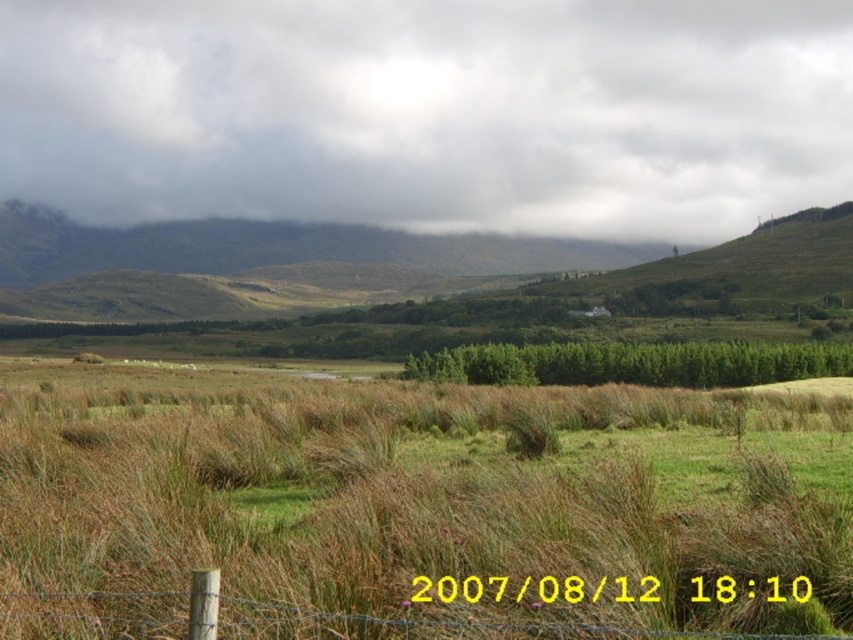
Question: Based on their relative distances, which object is farther from the brown dry grass at center?

Choices:
 (A) brown wooden fence at lower center
 (B) cloudy gray sky at upper center

Answer: (B)

Question: Considering the relative positions of cloudy gray sky at upper center and brown wooden fence at lower center in the image provided, where is cloudy gray sky at upper center located with respect to brown wooden fence at lower center?

Choices:
 (A) right
 (B) left

Answer: (B)

Question: Where is brown dry grass at center located in relation to brown wooden fence at lower center in the image?

Choices:
 (A) below
 (B) above

Answer: (A)

Question: Which point is closer to the camera?

Choices:
 (A) brown dry grass at center
 (B) cloudy gray sky at upper center

Answer: (A)

Question: Which object is farther from the camera taking this photo?

Choices:
 (A) brown wooden fence at lower center
 (B) cloudy gray sky at upper center

Answer: (B)

Question: Can you confirm if brown dry grass at center is positioned to the left of cloudy gray sky at upper center?

Choices:
 (A) no
 (B) yes

Answer: (B)